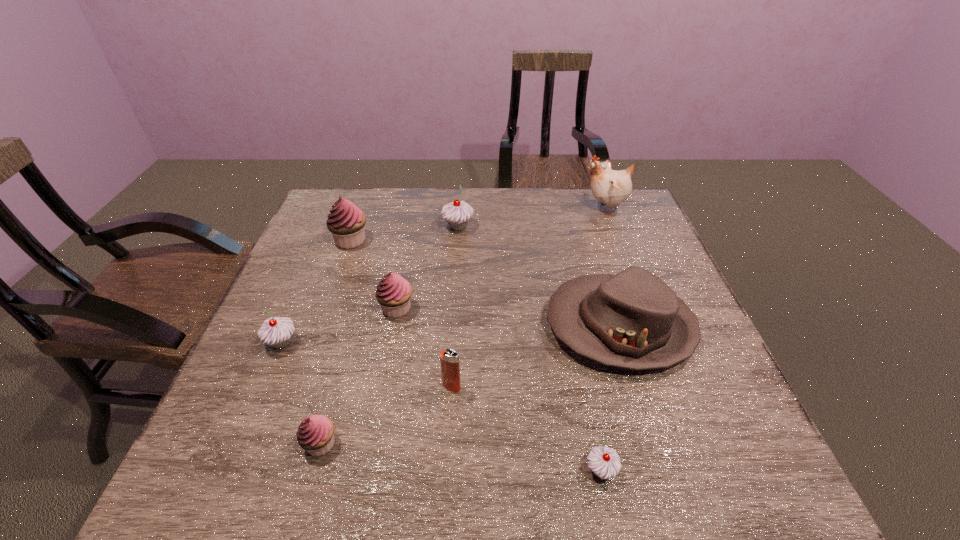
Locate an element on the screen. The height and width of the screenshot is (540, 960). object at the far left corner is located at coordinates (346, 222).

This screenshot has height=540, width=960. I want to click on object at the far right corner, so click(611, 187).

The image size is (960, 540). In the image, there is a desktop. Identify the location of blank space at the far edge. (374, 200).

Identify the location of vacant space at the near edge of the desktop. This screenshot has height=540, width=960. (350, 456).

This screenshot has width=960, height=540. What are the coordinates of `vacant space at the left edge of the desktop` in the screenshot? It's located at (283, 440).

In the image, there is a desktop. What are the coordinates of `vacant region at the near left corner` in the screenshot? It's located at (263, 489).

The height and width of the screenshot is (540, 960). Find the location of `unoccupied area between the white bird and the hat`. unoccupied area between the white bird and the hat is located at coordinates (612, 267).

The width and height of the screenshot is (960, 540). What are the coordinates of `free space between the bird and the hat` in the screenshot? It's located at (612, 267).

The height and width of the screenshot is (540, 960). I want to click on free area in between the second smallest pink cupcake and the second biggest gray cupcake, so click(x=340, y=326).

At what (x,y) coordinates should I click in order to perform the action: click on vacant space that's between the tallest object and the smallest pink cupcake. Please return your answer as a coordinate pair (x, y). This screenshot has width=960, height=540. Looking at the image, I should click on (463, 326).